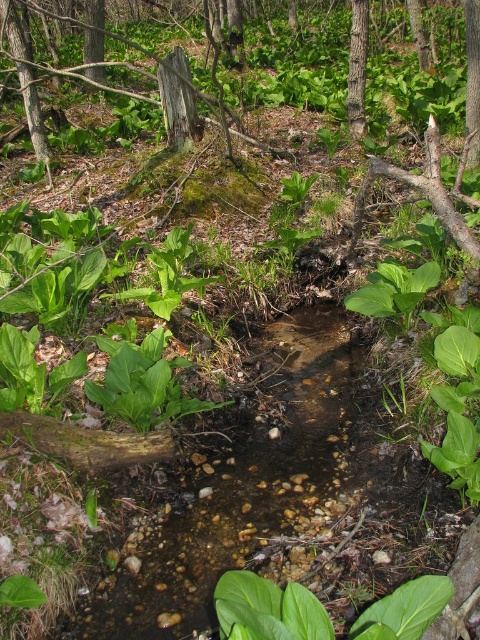
You are standing in the forest scene and want to walk from the point at coordinates point (351, 3) to the point at coordinates point (470, 76). Which direction should you move relative to the other point?

You should move forward towards point (470, 76) because point (351, 3) is behind it.

You are a hiker with a 2 meter long rope. You want to tie the smooth bark tree at center to the rough bark tree at upper right to create a makeshift bridge. Is the rope long enough to connect them?

The smooth bark tree at center is 1.91 meters from the rough bark tree at upper right. Since the rope is 2 meters long, it is long enough to connect them.

You are standing in the forest scene and see the point marked at coordinates (358, 67). What object does this point represent?

The point at coordinates (358, 67) represents the smooth bark tree at center.